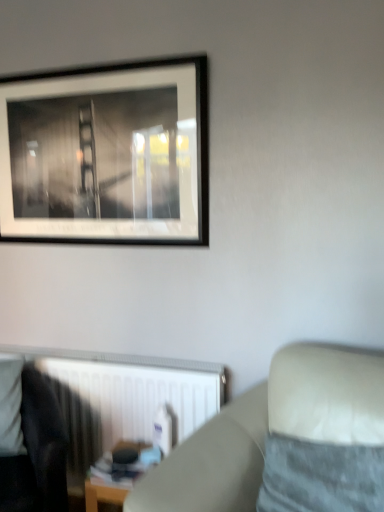
Question: Is velvety gray pillow at lower right positioned with its back to dark fabric rocking chair at lower left?

Choices:
 (A) yes
 (B) no

Answer: (B)

Question: Is velvety gray pillow at lower right at the left side of dark fabric rocking chair at lower left?

Choices:
 (A) no
 (B) yes

Answer: (A)

Question: Does velvety gray pillow at lower right have a lesser width compared to dark fabric rocking chair at lower left?

Choices:
 (A) yes
 (B) no

Answer: (A)

Question: Is velvety gray pillow at lower right closer to camera compared to dark fabric rocking chair at lower left?

Choices:
 (A) yes
 (B) no

Answer: (A)

Question: Considering the relative sizes of velvety gray pillow at lower right and dark fabric rocking chair at lower left in the image provided, is velvety gray pillow at lower right smaller than dark fabric rocking chair at lower left?

Choices:
 (A) no
 (B) yes

Answer: (B)

Question: From the image's perspective, is velvety gray pillow at lower right beneath dark fabric rocking chair at lower left?

Choices:
 (A) yes
 (B) no

Answer: (B)

Question: Does velvety gray pillow at lower right have a greater width compared to white plastic radiator at lower left?

Choices:
 (A) yes
 (B) no

Answer: (A)

Question: Is velvety gray pillow at lower right beside white plastic radiator at lower left?

Choices:
 (A) no
 (B) yes

Answer: (A)

Question: Does velvety gray pillow at lower right have a lesser height compared to white plastic radiator at lower left?

Choices:
 (A) no
 (B) yes

Answer: (B)

Question: Is velvety gray pillow at lower right oriented towards white plastic radiator at lower left?

Choices:
 (A) no
 (B) yes

Answer: (A)

Question: Considering the relative sizes of velvety gray pillow at lower right and white plastic radiator at lower left in the image provided, is velvety gray pillow at lower right bigger than white plastic radiator at lower left?

Choices:
 (A) no
 (B) yes

Answer: (A)

Question: From the image's perspective, is velvety gray pillow at lower right on white plastic radiator at lower left?

Choices:
 (A) no
 (B) yes

Answer: (B)

Question: From the image's perspective, does black matte picture frame at upper left appear lower than velvety gray pillow at lower right?

Choices:
 (A) yes
 (B) no

Answer: (B)